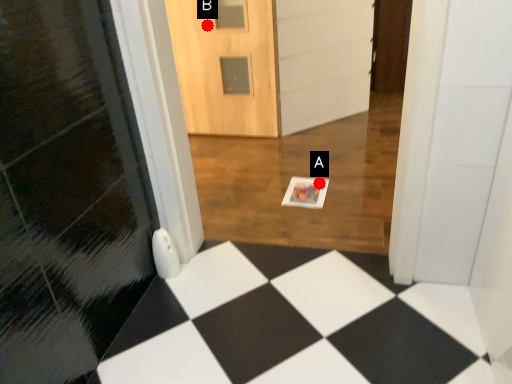
Question: Two points are circled on the image, labeled by A and B beside each circle. Which of the following is the closest to the observer?

Choices:
 (A) A is closer
 (B) B is closer

Answer: (A)